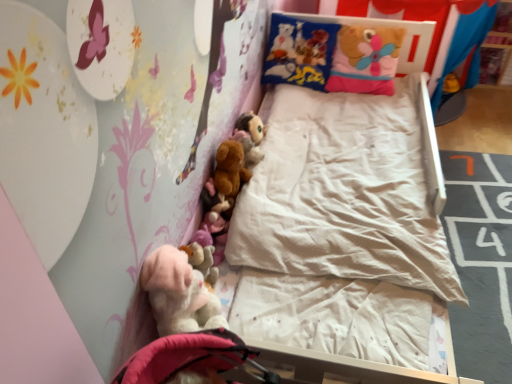
Image resolution: width=512 pixels, height=384 pixels. Find the location of `fluffy pink stuffed animal at lower left, arranged as the first toy when viewed from the front`. fluffy pink stuffed animal at lower left, arranged as the first toy when viewed from the front is located at coordinates (202, 260).

Locate an element on the screen. The height and width of the screenshot is (384, 512). fuzzy brown plush at upper center, acting as the third toy starting from the front is located at coordinates (251, 126).

How different are the orientations of fuzzy brown plush at upper center, which ranks as the third toy in bottom-to-top order, and fluffy pink stuffed animal at lower left, arranged as the first toy when ordered from the bottom, in degrees?

The angular difference between fuzzy brown plush at upper center, which ranks as the third toy in bottom-to-top order, and fluffy pink stuffed animal at lower left, arranged as the first toy when ordered from the bottom, is 1.79 degrees.

In the scene shown: Which of these two, fuzzy brown plush at upper center, which ranks as the third toy in bottom-to-top order, or fluffy pink stuffed animal at lower left, which ranks as the third toy in top-to-bottom order, is bigger?

With larger size is fuzzy brown plush at upper center, which ranks as the third toy in bottom-to-top order.

Does fuzzy brown plush at upper center, the 1th toy from the back, touch fluffy pink stuffed animal at lower left, the 3th toy in the back-to-front sequence?

No, fuzzy brown plush at upper center, the 1th toy from the back, is not with fluffy pink stuffed animal at lower left, the 3th toy in the back-to-front sequence.

Is fuzzy brown plush at upper center, marked as the 1th toy in a top-to-bottom arrangement, taller or shorter than fluffy pink stuffed animal at lower left, arranged as the first toy when viewed from the front?

In the image, fuzzy brown plush at upper center, marked as the 1th toy in a top-to-bottom arrangement, appears to be taller than fluffy pink stuffed animal at lower left, arranged as the first toy when viewed from the front.

Is fluffy pink stuffed animal at lower left, arranged as the first toy when ordered from the bottom, looking in the opposite direction of brown plush toy at center, the 2th toy positioned from the back?

fluffy pink stuffed animal at lower left, arranged as the first toy when ordered from the bottom, is not turned away from brown plush toy at center, the 2th toy positioned from the back.

From a real-world perspective, which object stands above the other?

brown plush toy at center, the 2th toy positioned from the back.

Can you confirm if fluffy pink stuffed animal at lower left, which ranks as the third toy in top-to-bottom order, is positioned to the right of brown plush toy at center, which is the 2th toy from front to back?

No.

Which object is closer to the camera, fluffy pink stuffed animal at lower left, arranged as the first toy when ordered from the bottom, or brown plush toy at center, the 2th toy positioned from the back?

fluffy pink stuffed animal at lower left, arranged as the first toy when ordered from the bottom, is closer to the camera.

Is point (200, 269) closer or farther from the camera than point (377, 51)?

Clearly, point (200, 269) is closer to the camera than point (377, 51).

Does fluffy pink stuffed animal at lower left, the 3th toy in the back-to-front sequence, have a smaller size compared to soft plush pillow at upper right?

Correct, fluffy pink stuffed animal at lower left, the 3th toy in the back-to-front sequence, occupies less space than soft plush pillow at upper right.

Which of these two, fluffy pink stuffed animal at lower left, which ranks as the third toy in top-to-bottom order, or soft plush pillow at upper right, stands taller?

soft plush pillow at upper right is taller.

Is fluffy pink stuffed animal at lower left, which ranks as the third toy in top-to-bottom order, turned away from soft plush pillow at upper right?

No, fluffy pink stuffed animal at lower left, which ranks as the third toy in top-to-bottom order,'s orientation is not away from soft plush pillow at upper right.

This screenshot has height=384, width=512. What are the coordinates of `teddy that appears in front of the fuzzy brown plush at upper center, the 1th toy from the back` in the screenshot? It's located at (179, 293).

Is fluffy pink teddy at lower left spatially inside fuzzy brown plush at upper center, the 1th toy from the back, or outside of it?

The correct answer is: outside.

How much distance is there between fluffy pink teddy at lower left and fuzzy brown plush at upper center, the 1th toy from the back?

fluffy pink teddy at lower left and fuzzy brown plush at upper center, the 1th toy from the back, are 31.94 inches apart from each other.

Between fluffy pink teddy at lower left and fuzzy brown plush at upper center, marked as the 1th toy in a top-to-bottom arrangement, which one appears on the left side from the viewer's perspective?

Positioned to the left is fluffy pink teddy at lower left.

I want to click on teddy that is on the left side of fuzzy brown plush at upper center, acting as the third toy starting from the front, so click(179, 293).

Is point (252, 130) positioned before point (158, 270)?

No, (252, 130) is behind (158, 270).

Based on their sizes in the image, would you say fuzzy brown plush at upper center, which ranks as the third toy in bottom-to-top order, is bigger or smaller than fluffy pink teddy at lower left?

In the image, fuzzy brown plush at upper center, which ranks as the third toy in bottom-to-top order, appears to be smaller than fluffy pink teddy at lower left.

Is soft plush pillow at upper right facing towards fluffy pink stuffed animal at lower left, arranged as the first toy when ordered from the bottom?

Yes, soft plush pillow at upper right is oriented towards fluffy pink stuffed animal at lower left, arranged as the first toy when ordered from the bottom.

From a real-world perspective, is soft plush pillow at upper right above or below fluffy pink stuffed animal at lower left, arranged as the first toy when ordered from the bottom?

In terms of real-world spatial position, soft plush pillow at upper right is above fluffy pink stuffed animal at lower left, arranged as the first toy when ordered from the bottom.

Can you confirm if soft plush pillow at upper right is bigger than fluffy pink stuffed animal at lower left, arranged as the first toy when ordered from the bottom?

Correct, soft plush pillow at upper right is larger in size than fluffy pink stuffed animal at lower left, arranged as the first toy when ordered from the bottom.

Find the location of `the 3rd toy below the soft plush pillow at upper right (from the image's perspective)`. the 3rd toy below the soft plush pillow at upper right (from the image's perspective) is located at coordinates (202, 260).

Is fluffy pink stuffed animal at lower left, which ranks as the third toy in top-to-bottom order, at the back of fluffy pink teddy at lower left?

No, fluffy pink teddy at lower left is not facing the opposite direction of fluffy pink stuffed animal at lower left, which ranks as the third toy in top-to-bottom order.

How different are the orientations of fluffy pink teddy at lower left and fluffy pink stuffed animal at lower left, which ranks as the third toy in top-to-bottom order, in degrees?

2.42 degrees separate the facing orientations of fluffy pink teddy at lower left and fluffy pink stuffed animal at lower left, which ranks as the third toy in top-to-bottom order.

Would you say fluffy pink teddy at lower left is inside or outside fluffy pink stuffed animal at lower left, arranged as the first toy when ordered from the bottom?

fluffy pink teddy at lower left exists outside the volume of fluffy pink stuffed animal at lower left, arranged as the first toy when ordered from the bottom.

This screenshot has height=384, width=512. In order to click on teddy lying in front of the fluffy pink stuffed animal at lower left, the 3th toy in the back-to-front sequence in this screenshot , I will do `click(179, 293)`.

At what (x,y) coordinates should I click in order to perform the action: click on toy that is the 2nd object located above the fluffy pink stuffed animal at lower left, arranged as the first toy when viewed from the front (from the image's perspective). Please return your answer as a coordinate pair (x, y). The width and height of the screenshot is (512, 384). Looking at the image, I should click on (251, 126).

Where is `toy on the left side of brown plush toy at center, which is the second toy in bottom-to-top order`? This screenshot has width=512, height=384. toy on the left side of brown plush toy at center, which is the second toy in bottom-to-top order is located at coordinates tap(202, 260).

Considering their positions, is brown plush toy at center, which is the 2th toy from front to back, positioned further to fluffy pink teddy at lower left than fuzzy brown plush at upper center, which ranks as the third toy in bottom-to-top order?

Based on the image, fuzzy brown plush at upper center, which ranks as the third toy in bottom-to-top order, appears to be further to fluffy pink teddy at lower left.

Consider the image. Which object lies further to the anchor point soft plush pillow at upper right, fluffy pink teddy at lower left or fuzzy brown plush at upper center, marked as the 1th toy in a top-to-bottom arrangement?

The object further to soft plush pillow at upper right is fluffy pink teddy at lower left.

Looking at the image, which one is located closer to soft plush pillow at upper right, fluffy pink teddy at lower left or brown plush toy at center, positioned as the 2th toy in top-to-bottom order?

Among the two, brown plush toy at center, positioned as the 2th toy in top-to-bottom order, is located nearer to soft plush pillow at upper right.

Looking at the image, which one is located closer to brown plush toy at center, the 2th toy positioned from the back, fluffy pink stuffed animal at lower left, the 3th toy in the back-to-front sequence, or fuzzy brown plush at upper center, which ranks as the third toy in bottom-to-top order?

Based on the image, fuzzy brown plush at upper center, which ranks as the third toy in bottom-to-top order, appears to be nearer to brown plush toy at center, the 2th toy positioned from the back.

Which object lies further to the anchor point fuzzy brown plush at upper center, marked as the 1th toy in a top-to-bottom arrangement, fluffy pink stuffed animal at lower left, arranged as the first toy when viewed from the front, or soft plush pillow at upper right?

fluffy pink stuffed animal at lower left, arranged as the first toy when viewed from the front, is further to fuzzy brown plush at upper center, marked as the 1th toy in a top-to-bottom arrangement.

Considering their positions, is fuzzy brown plush at upper center, which ranks as the third toy in bottom-to-top order, positioned further to fluffy pink stuffed animal at lower left, arranged as the first toy when ordered from the bottom, than fluffy pink teddy at lower left?

The object further to fluffy pink stuffed animal at lower left, arranged as the first toy when ordered from the bottom, is fuzzy brown plush at upper center, which ranks as the third toy in bottom-to-top order.

Based on their spatial positions, is soft plush pillow at upper right or fluffy pink teddy at lower left further from brown plush toy at center, which is the 2th toy from front to back?

soft plush pillow at upper right is further to brown plush toy at center, which is the 2th toy from front to back.

Looking at the image, which one is located closer to fuzzy brown plush at upper center, marked as the 1th toy in a top-to-bottom arrangement, soft plush pillow at upper right or fluffy pink teddy at lower left?

Based on the image, soft plush pillow at upper right appears to be nearer to fuzzy brown plush at upper center, marked as the 1th toy in a top-to-bottom arrangement.

Where is `toy between fluffy pink teddy at lower left and brown plush toy at center, positioned as the 2th toy in top-to-bottom order, along the z-axis`? This screenshot has height=384, width=512. toy between fluffy pink teddy at lower left and brown plush toy at center, positioned as the 2th toy in top-to-bottom order, along the z-axis is located at coordinates (202, 260).

At what (x,y) coordinates should I click in order to perform the action: click on toy that lies between soft plush pillow at upper right and brown plush toy at center, which is the 2th toy from front to back, from top to bottom. Please return your answer as a coordinate pair (x, y). The width and height of the screenshot is (512, 384). Looking at the image, I should click on (251, 126).

The width and height of the screenshot is (512, 384). Find the location of `toy between fluffy pink stuffed animal at lower left, which ranks as the third toy in top-to-bottom order, and fuzzy brown plush at upper center, marked as the 1th toy in a top-to-bottom arrangement, along the z-axis`. toy between fluffy pink stuffed animal at lower left, which ranks as the third toy in top-to-bottom order, and fuzzy brown plush at upper center, marked as the 1th toy in a top-to-bottom arrangement, along the z-axis is located at coordinates (230, 170).